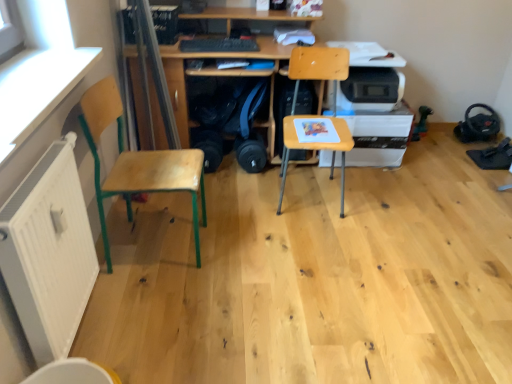
The width and height of the screenshot is (512, 384). What do you see at coordinates (179, 86) in the screenshot?
I see `wooden desk at center` at bounding box center [179, 86].

The height and width of the screenshot is (384, 512). What do you see at coordinates (218, 45) in the screenshot?
I see `black matte keyboard at center` at bounding box center [218, 45].

Based on the photo, in order to face white plastic printer at center right, should I rotate leftwards or rightwards?

You should rotate right by 13.913 degrees.

At what (x,y) coordinates should I click in order to perform the action: click on white matte radiator at lower left. Please return your answer as a coordinate pair (x, y). The image size is (512, 384). Looking at the image, I should click on (49, 252).

Choose the correct answer: Is wooden chair at center, arranged as the first chair when viewed from the right, inside wooden desk at center or outside it?

wooden chair at center, arranged as the first chair when viewed from the right, is located beyond the bounds of wooden desk at center.

Measure the distance from wooden chair at center, arranged as the first chair when viewed from the right, to wooden desk at center.

wooden chair at center, arranged as the first chair when viewed from the right, and wooden desk at center are 45.88 centimeters apart.

Can you confirm if wooden chair at center, the second chair when ordered from left to right, is wider than wooden desk at center?

In fact, wooden chair at center, the second chair when ordered from left to right, might be narrower than wooden desk at center.

Considering the points (301, 124) and (179, 51), which point is behind, point (301, 124) or point (179, 51)?

Positioned behind is point (179, 51).

The width and height of the screenshot is (512, 384). In order to click on desk positioned vertically above the wooden chair at center, the second chair when ordered from left to right (from a real-world perspective) in this screenshot , I will do `click(179, 86)`.

Would you say wooden desk at center contains wooden chair at center, the second chair when ordered from left to right?

No, wooden chair at center, the second chair when ordered from left to right, is not surrounded by wooden desk at center.

Is point (143, 108) positioned before point (348, 68)?

No, it is behind (348, 68).

Would you say white plastic printer at center right is inside or outside wooden chair at center, arranged as the first chair when viewed from the right?

white plastic printer at center right is outside wooden chair at center, arranged as the first chair when viewed from the right.

From the image's perspective, between white plastic printer at center right and wooden chair at center, the second chair when ordered from left to right, who is located below?

From the image's view, wooden chair at center, the second chair when ordered from left to right, is below.

Are white plastic printer at center right and wooden chair at center, arranged as the first chair when viewed from the right, far apart?

white plastic printer at center right is actually quite close to wooden chair at center, arranged as the first chair when viewed from the right.

Considering the relative sizes of white plastic printer at center right and wooden chair at center, arranged as the first chair when viewed from the right, in the image provided, is white plastic printer at center right wider than wooden chair at center, arranged as the first chair when viewed from the right,?

Indeed, white plastic printer at center right has a greater width compared to wooden chair at center, arranged as the first chair when viewed from the right.

Which point is more distant from viewer, [194,44] or [60,21]?

Point [194,44]

Is black matte keyboard at center to the left of transparent plastic window screen at left from the viewer's perspective?

In fact, black matte keyboard at center is to the right of transparent plastic window screen at left.

Is black matte keyboard at center situated inside transparent plastic window screen at left or outside?

black matte keyboard at center lies outside transparent plastic window screen at left.

Is transparent plastic window screen at left at the back of black matte keyboard at center?

No.

Can you confirm if transparent plastic window screen at left is taller than white plastic printer at center right?

No.

Can you confirm if transparent plastic window screen at left is thinner than white plastic printer at center right?

Correct, the width of transparent plastic window screen at left is less than that of white plastic printer at center right.

Considering the positions of objects transparent plastic window screen at left and white plastic printer at center right in the image provided, who is more to the right, transparent plastic window screen at left or white plastic printer at center right?

From the viewer's perspective, white plastic printer at center right appears more on the right side.

From the picture: Could you tell me if transparent plastic window screen at left is facing white plastic printer at center right?

No, transparent plastic window screen at left is not facing towards white plastic printer at center right.

From a real-world perspective, who is located higher, white matte radiator at lower left or wooden desk at center?

wooden desk at center is physically above.

Considering the sizes of white matte radiator at lower left and wooden desk at center in the image, is white matte radiator at lower left wider or thinner than wooden desk at center?

Clearly, white matte radiator at lower left has less width compared to wooden desk at center.

From the image's perspective, which is below, white matte radiator at lower left or wooden desk at center?

From the image's view, white matte radiator at lower left is below.

Based on the photo, is wooden at left, positioned as the 2th chair in right-to-left order, further to the viewer compared to black matte keyboard at center?

No, it is not.

Is wooden at left, which ranks as the first chair in left-to-right order, positioned with its back to black matte keyboard at center?

No, black matte keyboard at center is not at the back of wooden at left, which ranks as the first chair in left-to-right order.

Who is smaller, wooden at left, which ranks as the first chair in left-to-right order, or black matte keyboard at center?

black matte keyboard at center is smaller.

From the image's perspective, is wooden at left, positioned as the 2th chair in right-to-left order, under black matte keyboard at center?

Correct, wooden at left, positioned as the 2th chair in right-to-left order, appears lower than black matte keyboard at center in the image.

The width and height of the screenshot is (512, 384). Identify the location of desk that appears above the wooden chair at center, arranged as the first chair when viewed from the right (from the image's perspective). (179, 86).

Find the location of a particular element. The image size is (512, 384). chair that is the 1st object located in front of the wooden desk at center is located at coordinates (317, 116).

Looking at the image, which one is located further to black matte keyboard at center, white matte radiator at lower left or wooden at left, positioned as the 2th chair in right-to-left order?

white matte radiator at lower left lies further to black matte keyboard at center than the other object.

Based on their spatial positions, is wooden at left, which ranks as the first chair in left-to-right order, or white plastic printer at center right further from black matte keyboard at center?

wooden at left, which ranks as the first chair in left-to-right order, is positioned further to the anchor black matte keyboard at center.

From the image, which object appears to be nearer to transparent plastic window screen at left, wooden chair at center, arranged as the first chair when viewed from the right, or white matte radiator at lower left?

The object closer to transparent plastic window screen at left is white matte radiator at lower left.

Based on their spatial positions, is transparent plastic window screen at left or wooden chair at center, arranged as the first chair when viewed from the right, further from black matte keyboard at center?

transparent plastic window screen at left.

Estimate the real-world distances between objects in this image. Which object is closer to white matte radiator at lower left, wooden chair at center, arranged as the first chair when viewed from the right, or wooden at left, which ranks as the first chair in left-to-right order?

Based on the image, wooden at left, which ranks as the first chair in left-to-right order, appears to be nearer to white matte radiator at lower left.

Looking at the image, which one is located further to transparent plastic window screen at left, white matte radiator at lower left or black matte keyboard at center?

black matte keyboard at center lies further to transparent plastic window screen at left than the other object.

From the image, which object appears to be nearer to wooden chair at center, arranged as the first chair when viewed from the right, white matte radiator at lower left or black matte keyboard at center?

Among the two, black matte keyboard at center is located nearer to wooden chair at center, arranged as the first chair when viewed from the right.

Which object lies nearer to the anchor point wooden chair at center, arranged as the first chair when viewed from the right, wooden at left, positioned as the 2th chair in right-to-left order, or black matte keyboard at center?

Among the two, black matte keyboard at center is located nearer to wooden chair at center, arranged as the first chair when viewed from the right.

Locate an element on the screen. chair located between transparent plastic window screen at left and wooden chair at center, arranged as the first chair when viewed from the right, in the left-right direction is located at coordinates tap(137, 163).

The image size is (512, 384). I want to click on desk between transparent plastic window screen at left and black matte keyboard at center in the front-back direction, so click(179, 86).

The height and width of the screenshot is (384, 512). In order to click on radiator located between transparent plastic window screen at left and wooden chair at center, the second chair when ordered from left to right, in the left-right direction in this screenshot , I will do `click(49, 252)`.

This screenshot has height=384, width=512. I want to click on desk between black matte keyboard at center and white plastic printer at center right in the horizontal direction, so click(x=179, y=86).